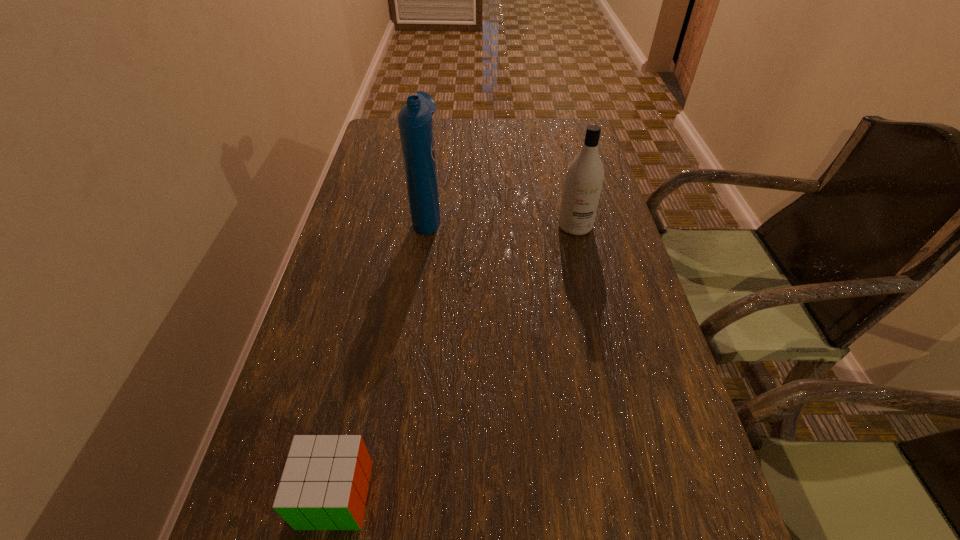
Identify the location of object situated at the right edge. The width and height of the screenshot is (960, 540). (584, 178).

This screenshot has height=540, width=960. Identify the location of free space at the left edge of the desktop. (337, 327).

The width and height of the screenshot is (960, 540). I want to click on free space at the right edge of the desktop, so tap(642, 514).

In order to click on vacant region between the taller shampoo and the cube in this screenshot , I will do `click(382, 354)`.

Image resolution: width=960 pixels, height=540 pixels. Identify the location of empty space that is in between the shortest object and the taller shampoo. (382, 354).

At what (x,y) coordinates should I click in order to perform the action: click on free space between the left shampoo and the shortest object. Please return your answer as a coordinate pair (x, y). Image resolution: width=960 pixels, height=540 pixels. Looking at the image, I should click on (382, 354).

Identify the location of free space between the nearest object and the left shampoo. (382, 354).

Where is `unoccupied area between the cube and the right shampoo`? Image resolution: width=960 pixels, height=540 pixels. unoccupied area between the cube and the right shampoo is located at coordinates (x=455, y=360).

Find the location of `vacant space that is in between the left shampoo and the rightmost object`. vacant space that is in between the left shampoo and the rightmost object is located at coordinates (501, 220).

I want to click on free space between the cube and the rightmost object, so click(x=455, y=360).